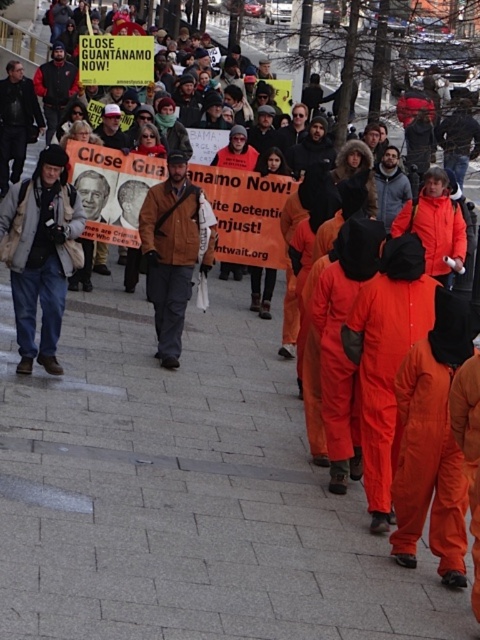
You are a photographer at the protest march. You want to capture a photo that includes both the matte beige jacket at center and the sign reading CLOSE GUANTANAMO NOW! in the background. Based on their positions, can you position yourself so that both are visible in the frame?

The matte beige jacket at center is located at point (40,253). Since the sign reading CLOSE GUANTANAMO NOW! is part of the larger crowd behind them, positioning yourself in a way that captures both might be possible if the jacket is in the foreground and the sign is visible in the background. However, without exact coordinates for the sign, it is uncertain. The answer would depend on the spatial arrangement not fully detailed here.

You are a photographer standing at the camera position. You want to take a closeup photo of the matte beige jacket at center. Can you walk forward to get a closer shot without exceeding the protest march crowd?

The matte beige jacket at center is 37.78 feet away from the camera. Since the crowd is behind the individuals in orange jumpsuits, you can walk forward to reduce the distance and take a closer photo as long as you stay within the protest march area.